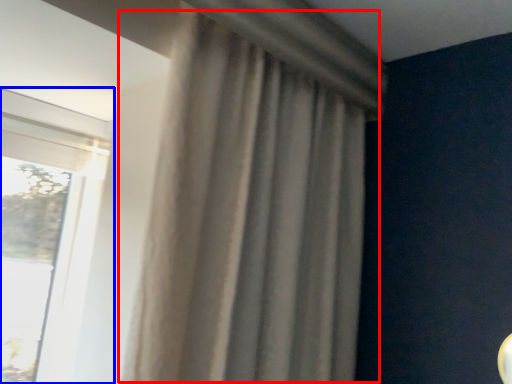
Question: Which point is closer to the camera, curtain (highlighted by a red box) or window (highlighted by a blue box)?

Choices:
 (A) curtain
 (B) window

Answer: (A)